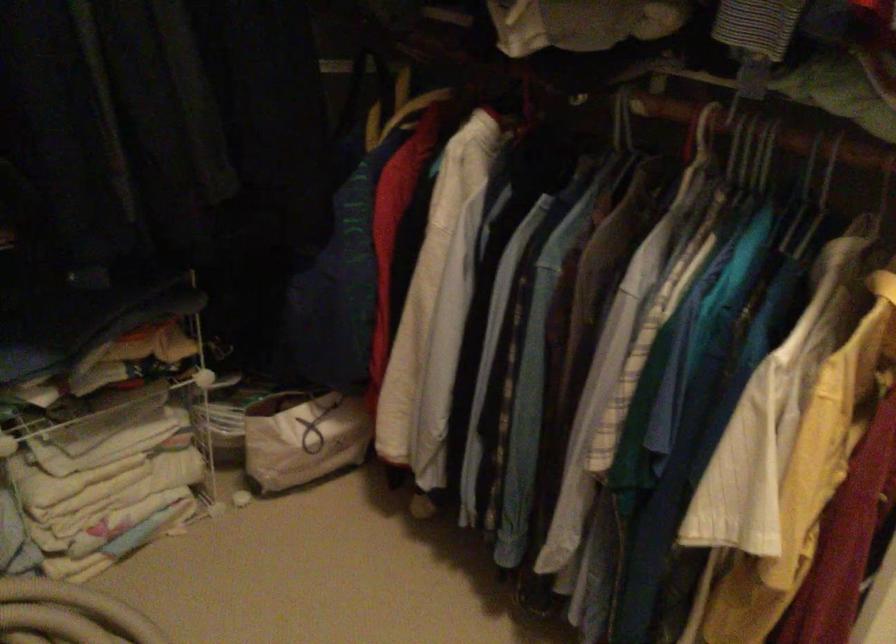
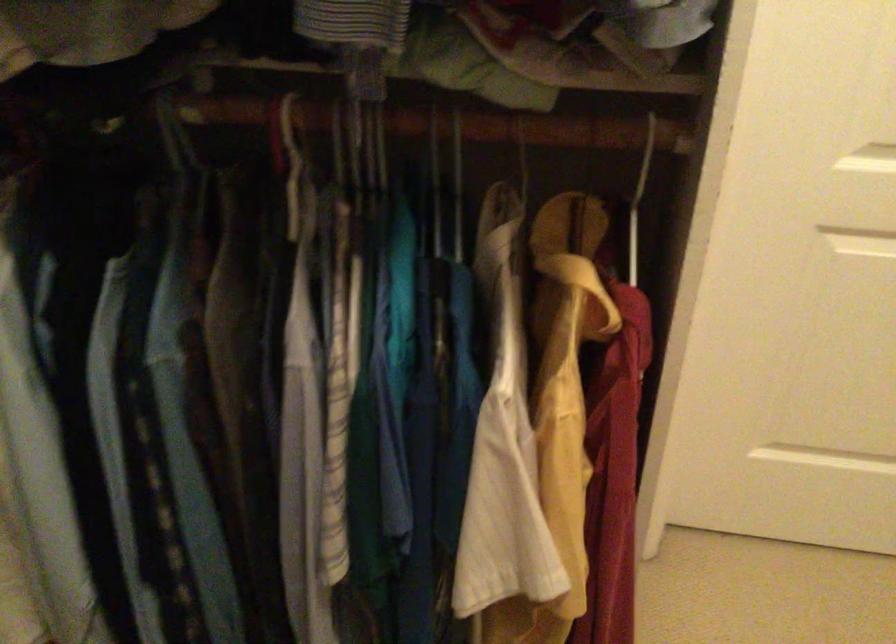
In the second image, find the point that corresponds to [622,122] in the first image.

(179, 138)